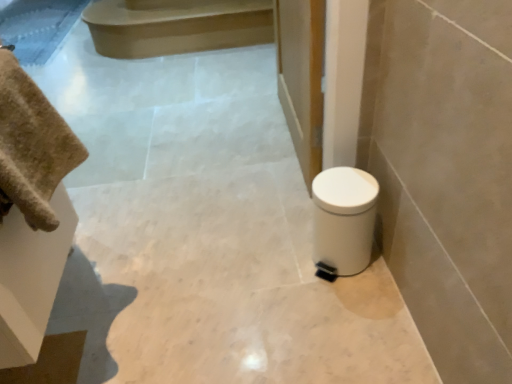
I want to click on vacant space underneath beige cotton towel at left (from a real-world perspective), so tap(121, 346).